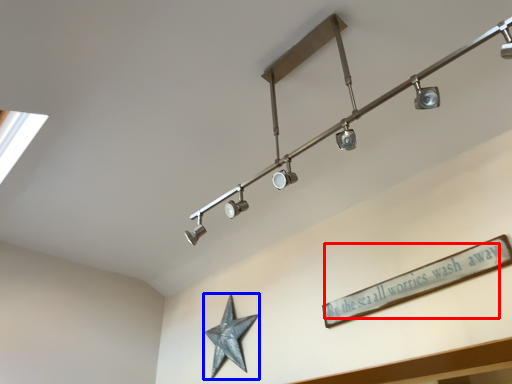
Question: Among these objects, which one is nearest to the camera, writing (highlighted by a red box) or star (highlighted by a blue box)?

Choices:
 (A) writing
 (B) star

Answer: (A)